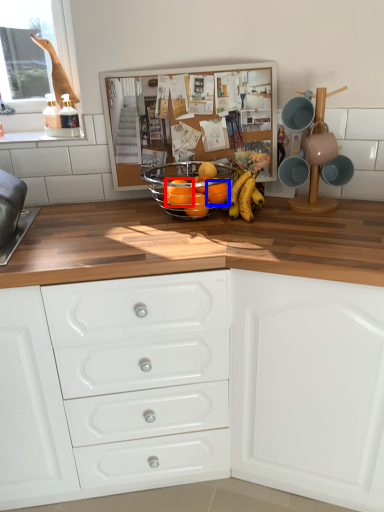
Question: Which object appears farthest to the camera in this image, orange (highlighted by a red box) or orange (highlighted by a blue box)?

Choices:
 (A) orange
 (B) orange

Answer: (B)